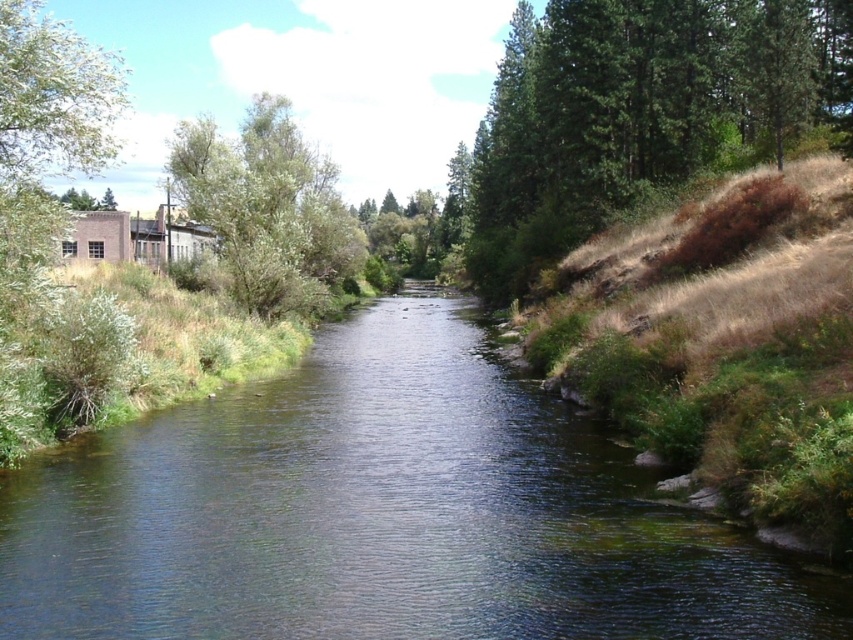
Question: Based on their relative distances, which object is nearer to the green leafy tree at upper left?

Choices:
 (A) green textured tree at right
 (B) green leafy tree at left

Answer: (A)

Question: Is green leafy tree at left thinner than green leafy tree at upper left?

Choices:
 (A) no
 (B) yes

Answer: (A)

Question: Can you confirm if clear water at center is wider than green leafy tree at upper left?

Choices:
 (A) yes
 (B) no

Answer: (B)

Question: Does clear water at center appear on the left side of green leafy tree at left?

Choices:
 (A) yes
 (B) no

Answer: (B)

Question: Which is farther from the green leafy tree at upper left?

Choices:
 (A) clear water at center
 (B) green textured tree at right

Answer: (A)

Question: Which point appears closest to the camera in this image?

Choices:
 (A) click(x=80, y=36)
 (B) click(x=538, y=554)
 (C) click(x=548, y=156)

Answer: (B)